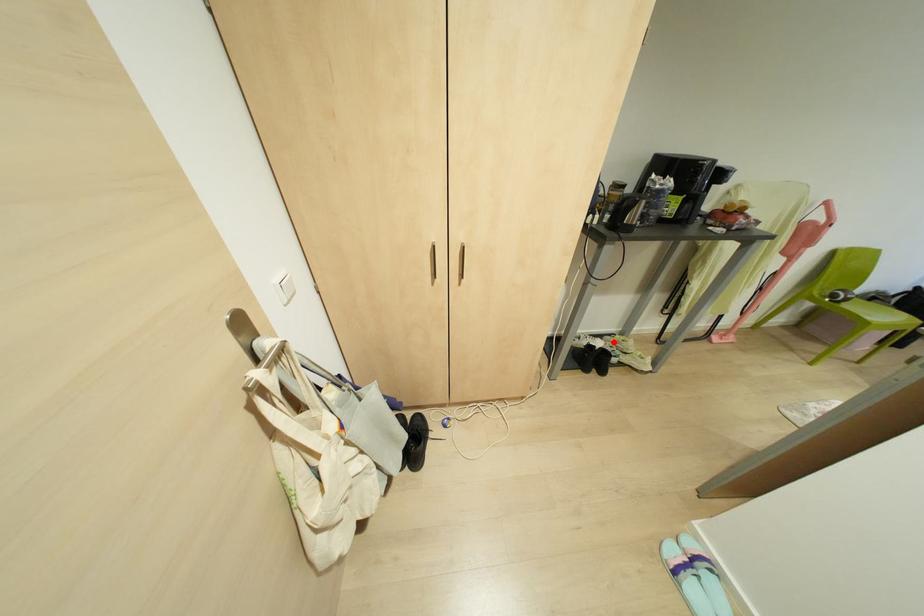
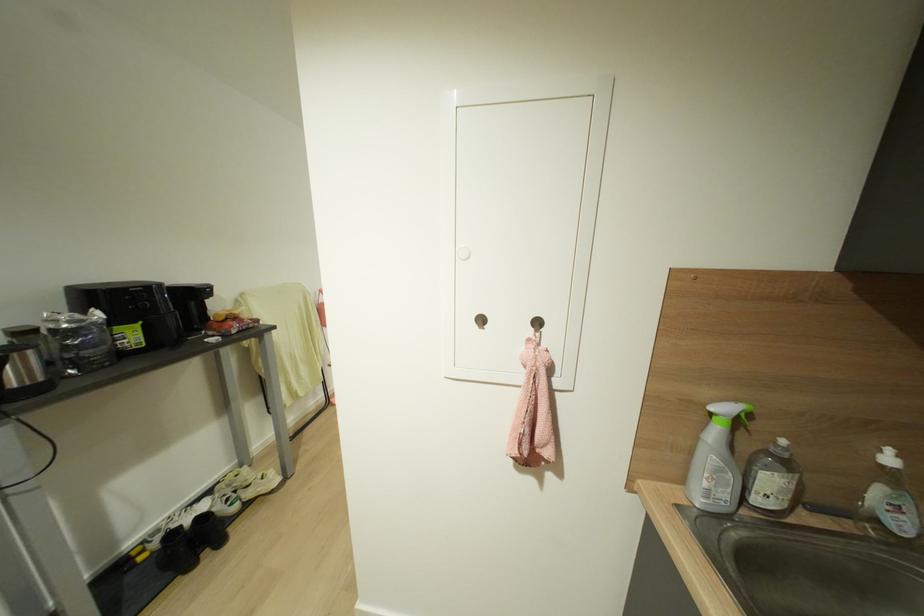
Find the pixel in the second image that matches the highlighted location in the first image.

(227, 485)